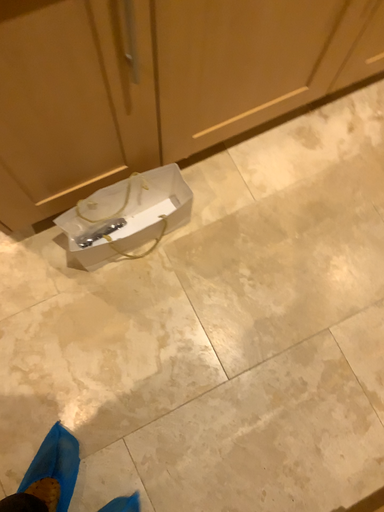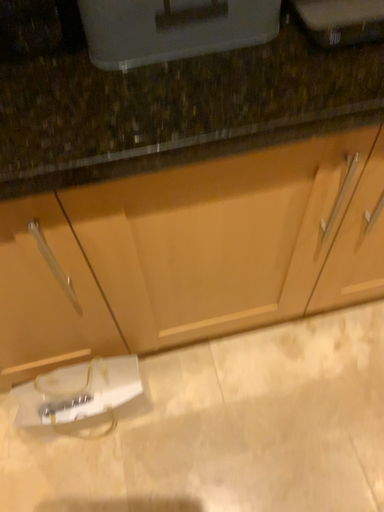
Question: How did the camera likely rotate when shooting the video?

Choices:
 (A) rotated left
 (B) rotated right

Answer: (A)